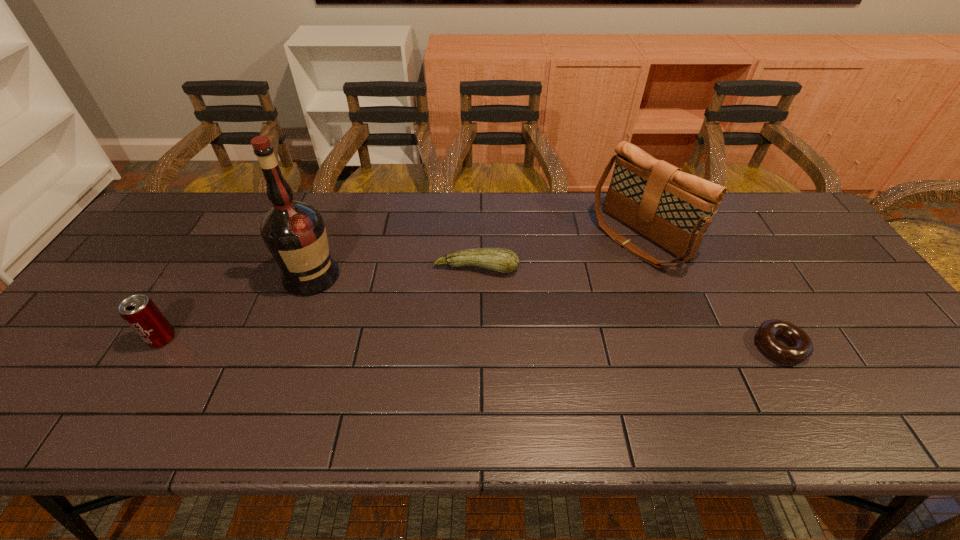
Where is `free space that satisfies the following two spatial constraints: 1. on the back side of the tallest object; 2. on the left side of the second tallest object`? The width and height of the screenshot is (960, 540). free space that satisfies the following two spatial constraints: 1. on the back side of the tallest object; 2. on the left side of the second tallest object is located at coordinates (325, 238).